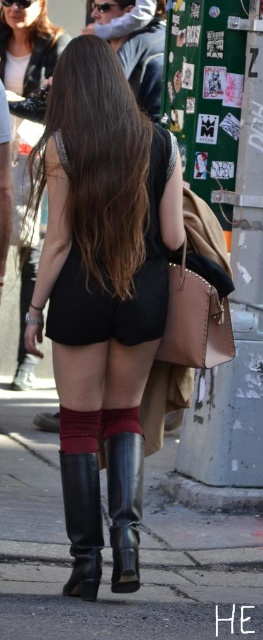
You are a fashion designer observing the image. You need to determine if the black matte dress at center can be paired with the black leather boot at lower center based on their positions. Can they be worn together?

The black matte dress at center is taller than the black leather boot at lower center, so yes, they can be worn together as the dress covers the boot appropriately.

You are a fashion designer observing the scene and want to create a new outfit. Given that the matte black shorts at center are wider than the black matte dress at center, which item would allow for more comfortable movement while walking?

The matte black shorts at center would allow for more comfortable movement while walking since they are wider than the black matte dress at center.